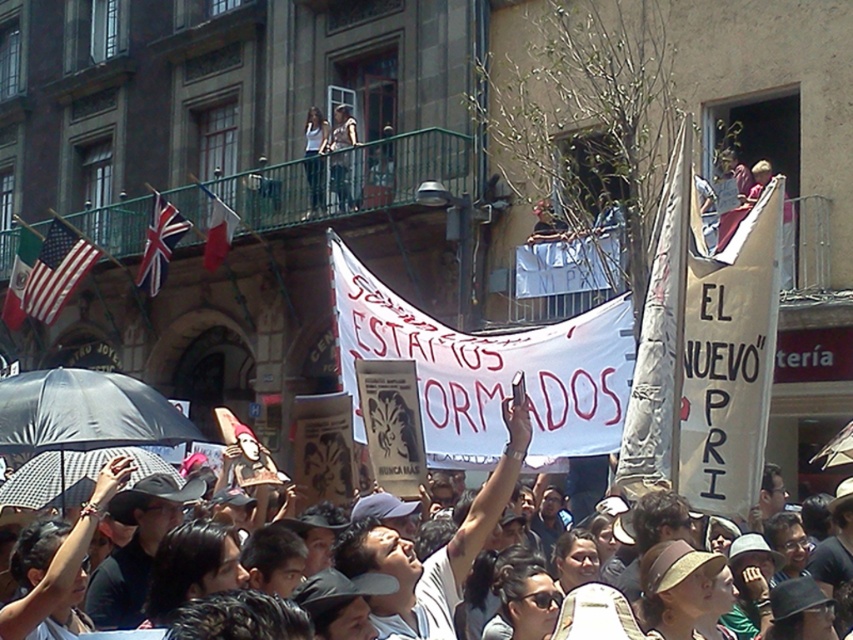
You are a photographer standing at the camera position. You want to capture a closeup shot of the light blue jeans at upper center. Considering the distance, is it feasible to do so with a standard zoom lens that has a maximum effective focal length of 200mm?

The light blue jeans at upper center is 69.66 meters away from the camera. With a standard zoom lens of 200mm, it may be challenging to capture a clear closeup due to the distance. A longer focal length or additional equipment like a telephoto lens would be more suitable for such a distant subject.

You are a photographer standing at the origin point in the image. You need to capture a closeup shot of the light blue jeans at upper center. Which direction should you move to get closer to it?

The light blue jeans at upper center is located at point 0.242 on the x axis and 0.401 on the y axis. Since the photographer is at the origin, moving towards the upper center direction would involve increasing both the x and y coordinates. Therefore, moving northeast would bring the photographer closer to the light blue jeans at upper center.